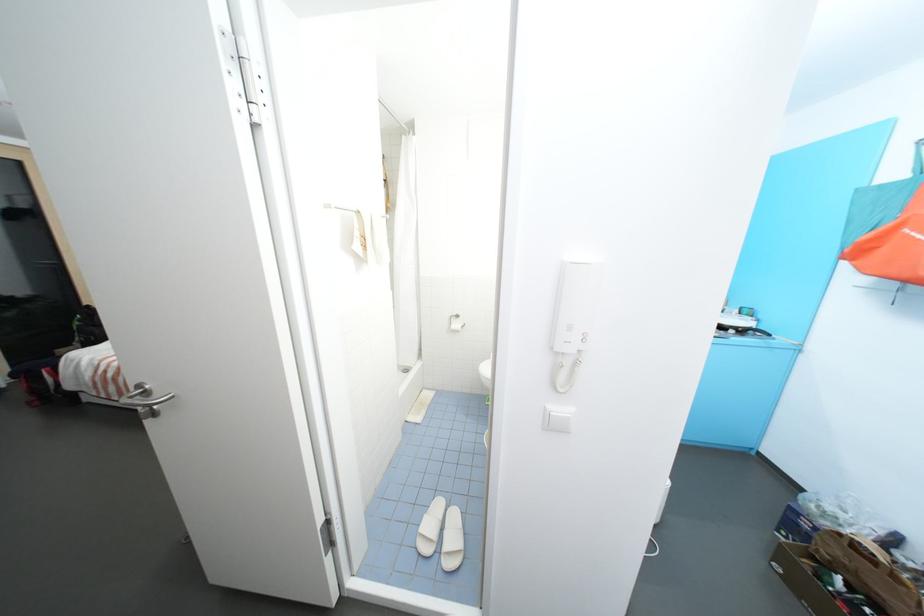
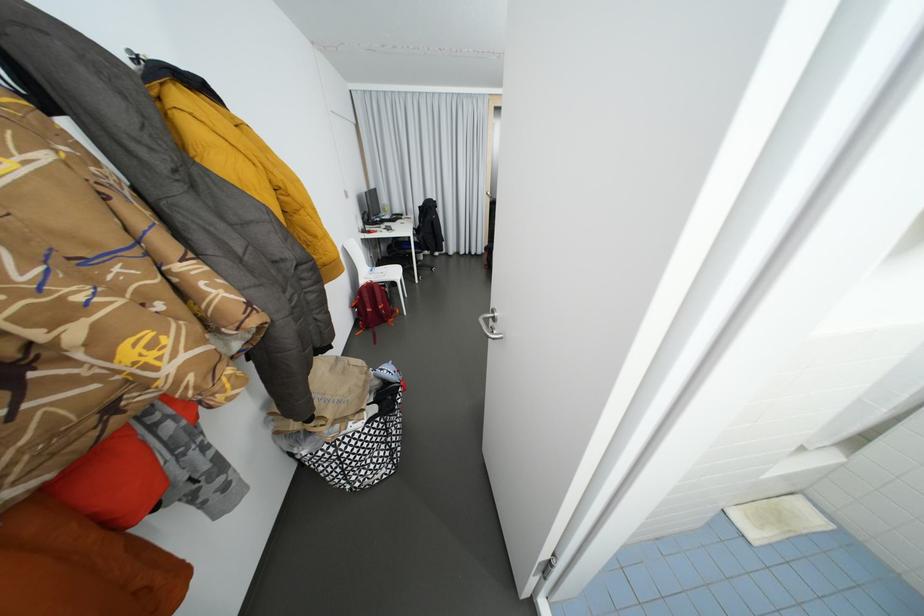
How did the camera likely rotate?

The camera's rotation is toward left-down.